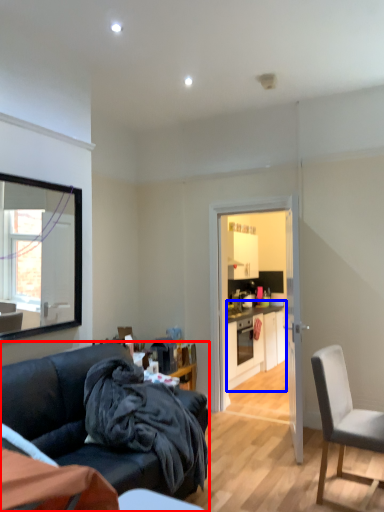
Question: Among these objects, which one is nearest to the camera, studio couch (highlighted by a red box) or cabinetry (highlighted by a blue box)?

Choices:
 (A) studio couch
 (B) cabinetry

Answer: (A)